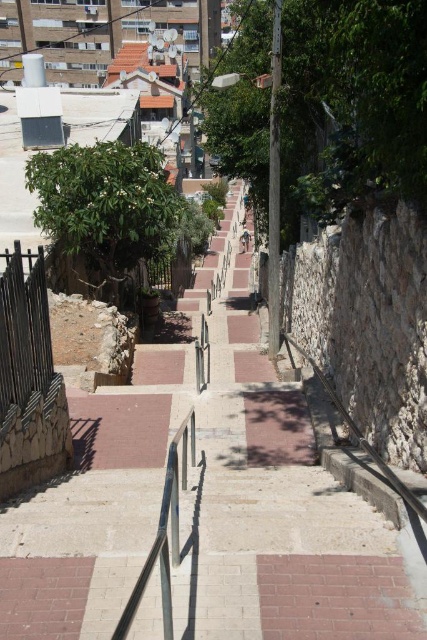
You are a delivery person carrying a heavy box and need to walk up the staircase. You notice the brick pavement at center and the polished metal rail at center. Which surface is more likely to be slippery when wet?

The polished metal rail at center is more likely to be slippery when wet because the brick pavement at center is positioned over it, indicating the rail might be a smooth metal surface prone to slipping.

You are a delivery person carrying a large box that is 1 meter wide. You need to walk up the staircase while avoiding the brick pavement at center. Can you fit through the space between the polished metal rail at center and the wall on your right?

The brick pavement at center has a larger size compared to polished metal rail at center, so the space between the polished metal rail at center and the wall on the right is narrower than the brick pavement. Since your box is 1 meter wide, you need to check if the space is at least 1 meter wide. However, since the brick pavement is larger, the metal rail is smaller, so the space between the rail and the wall might be narrower than 1 meter. It is safer to avoid this path as the space might be too narrow for

You are standing at the bottom of the staircase and want to walk to the point marked as point (207, 508). According to the image, where will you end up walking to?

The point (207, 508) is on brick pavement at center, so you will end up walking to the brick pavement at center.